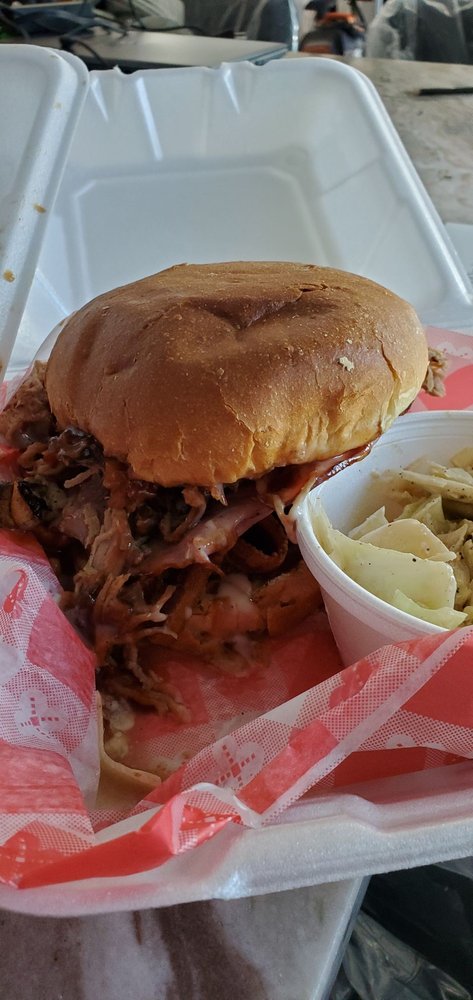
At what (x,y) coordinates should I click in order to perform the action: click on desk. Please return your answer as a coordinate pair (x, y). This screenshot has height=1000, width=473. Looking at the image, I should click on (444, 148).